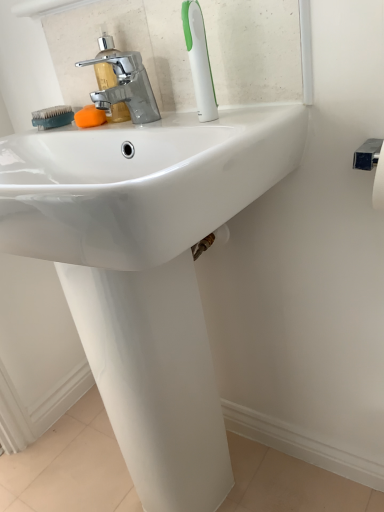
You are a GUI agent. You are given a task and a screenshot of the screen. Output one action in this format:
    pyautogui.click(x=<x>, y=<y>)
    Task: Click on the free space in front of orange sponge at center
    The image size is (384, 512).
    Given the screenshot: What is the action you would take?
    pyautogui.click(x=120, y=126)